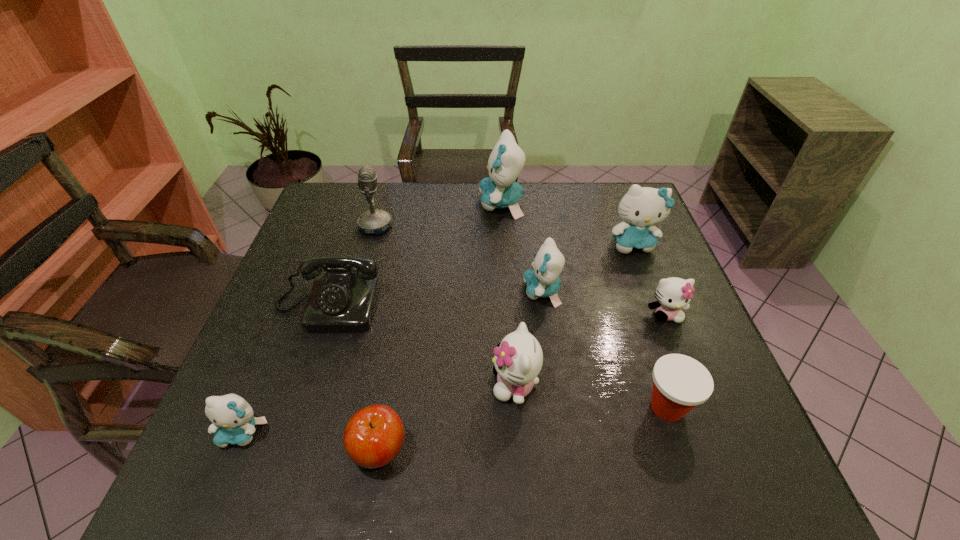
Locate an element on the screen. The width and height of the screenshot is (960, 540). free space between the black telephone and the biggest blue kitten is located at coordinates (415, 255).

In order to click on vacant space in between the apple and the biggest blue kitten in this screenshot , I will do `click(441, 327)`.

This screenshot has width=960, height=540. Find the location of `unoccupied area between the black telephone and the third biggest blue kitten`. unoccupied area between the black telephone and the third biggest blue kitten is located at coordinates (435, 299).

Locate an element on the screen. This screenshot has height=540, width=960. free spot between the left white kitten and the red-orange Dixie cup is located at coordinates (591, 396).

At what (x,y) coordinates should I click in order to perform the action: click on free point between the apple and the telephone. Please return your answer as a coordinate pair (x, y). Looking at the image, I should click on (353, 379).

Point out which object is positioned as the sixth nearest to the Dixie cup. Please provide its 2D coordinates. Your answer should be formatted as a tuple, i.e. [(x, y)], where the tuple contains the x and y coordinates of a point satisfying the conditions above.

[(343, 300)]

Identify which object is located as the third nearest to the telephone. Please provide its 2D coordinates. Your answer should be formatted as a tuple, i.e. [(x, y)], where the tuple contains the x and y coordinates of a point satisfying the conditions above.

[(373, 437)]

The height and width of the screenshot is (540, 960). I want to click on kitten that is the fifth closest to the apple, so click(x=499, y=190).

Locate an element on the screen. kitten that is the third closest to the left white kitten is located at coordinates (641, 207).

At what (x,y) coordinates should I click in order to perform the action: click on the second closest blue kitten to the black telephone. Please return your answer as a coordinate pair (x, y). Looking at the image, I should click on click(543, 280).